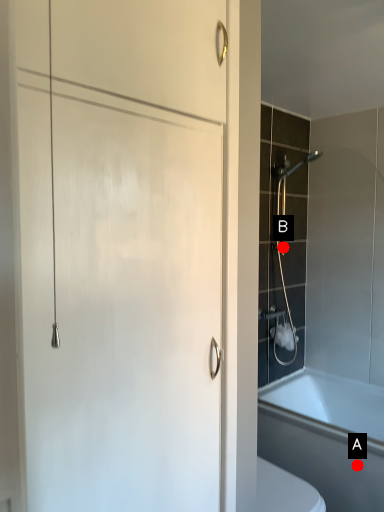
Question: Two points are circled on the image, labeled by A and B beside each circle. Which point is farther to the camera?

Choices:
 (A) A is further
 (B) B is further

Answer: (B)